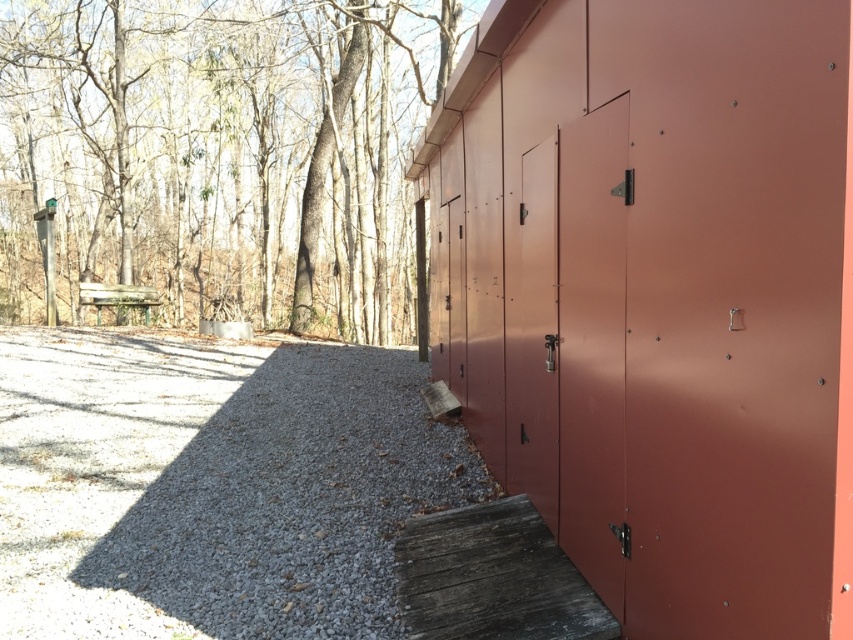
Is point (689, 412) behind point (527, 189)?

That is False.

Find the location of a particular element. metallic red cabinet at right is located at coordinates (657, 296).

Between bare wood tree at upper left and weathered wood ramp at lower center, which one is positioned higher?

bare wood tree at upper left

Is point (13, 42) farther from viewer compared to point (550, 573)?

Yes, it is.

Which is in front, point (189, 61) or point (426, 636)?

Positioned in front is point (426, 636).

The image size is (853, 640). What are the coordinates of `bare wood tree at upper left` in the screenshot? It's located at (218, 157).

In the scene shown: Is weathered wood ramp at lower center behind matte metal door at center?

No.

Is point (407, 540) positioned behind point (538, 320)?

That is True.

Is point (426, 612) closer to viewer compared to point (552, 156)?

Yes, point (426, 612) is closer to viewer.

At what (x,y) coordinates should I click in order to perform the action: click on weathered wood ramp at lower center. Please return your answer as a coordinate pair (x, y). Looking at the image, I should click on (492, 577).